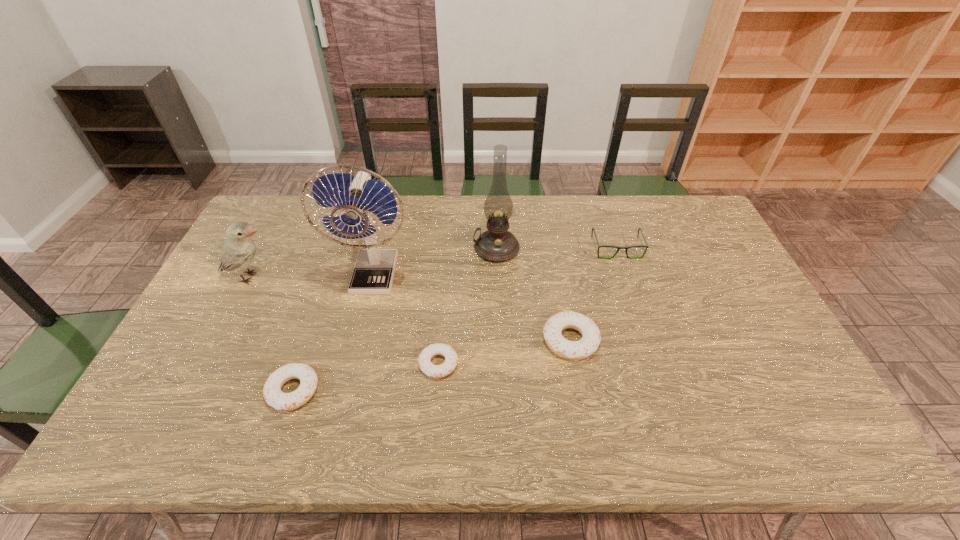
Please point out where to position a new doughnut on the right to maintain spacing. Please provide its 2D coordinates. Your answer should be formatted as a tuple, i.e. [(x, y)], where the tuple contains the x and y coordinates of a point satisfying the conditions above.

[(690, 318)]